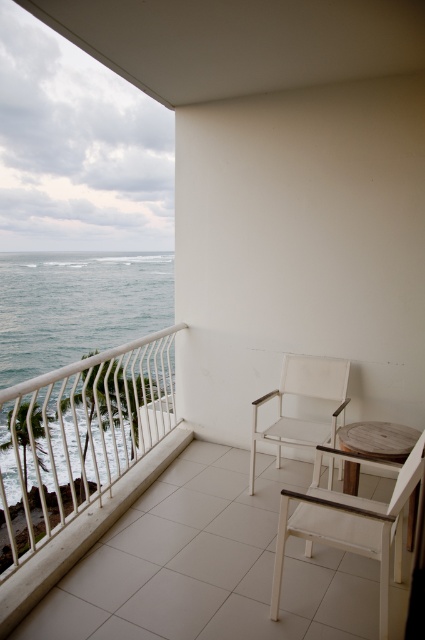
Question: Where is white metal railing at upper left located in relation to wooden table at center in the image?

Choices:
 (A) above
 (B) below

Answer: (B)

Question: Which object appears farthest from the camera in this image?

Choices:
 (A) white wood chair at lower right
 (B) white fabric chair at center
 (C) white metal railing at upper left

Answer: (B)

Question: Where is white fabric chair at center located in relation to wooden table at center in the image?

Choices:
 (A) below
 (B) above

Answer: (B)

Question: Which object appears closest to the camera in this image?

Choices:
 (A) wooden table at center
 (B) white metal railing at upper left

Answer: (B)

Question: Is white fabric chair at center above wooden table at center?

Choices:
 (A) no
 (B) yes

Answer: (B)

Question: Which is nearer to the wooden table at center?

Choices:
 (A) white wood chair at lower right
 (B) white fabric chair at center
 (C) white metal railing at upper left

Answer: (B)